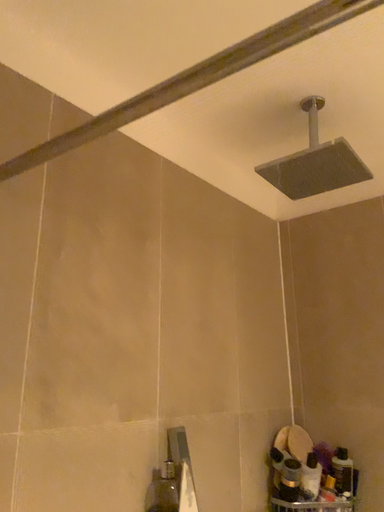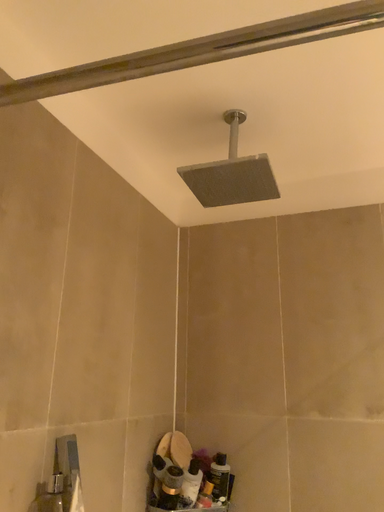
Question: How did the camera likely rotate when shooting the video?

Choices:
 (A) rotated left
 (B) rotated right

Answer: (B)